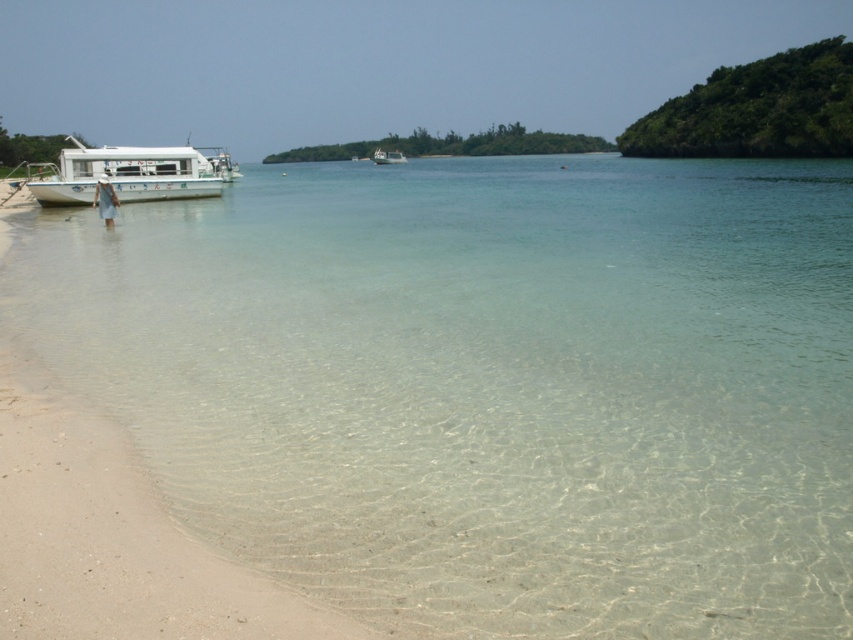
Question: Which point is closer to the camera?

Choices:
 (A) (392, 150)
 (B) (192, 180)

Answer: (B)

Question: Among these points, which one is farthest from the camera?

Choices:
 (A) (397, 163)
 (B) (128, 160)

Answer: (A)

Question: Does white matte boat at left have a lesser width compared to white glossy boat at center?

Choices:
 (A) yes
 (B) no

Answer: (B)

Question: Is white matte boat at left thinner than white glossy boat at center?

Choices:
 (A) no
 (B) yes

Answer: (A)

Question: Does white matte boat at left appear under white glossy boat at center?

Choices:
 (A) no
 (B) yes

Answer: (B)